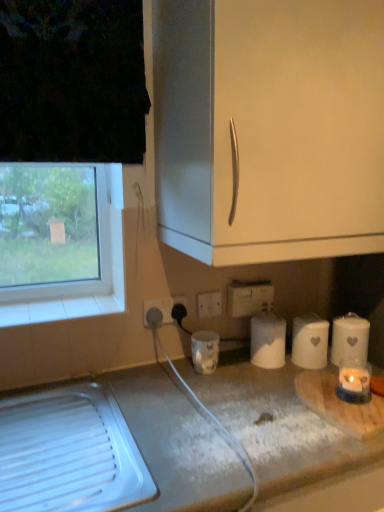
At what (x,y) coordinates should I click in order to perform the action: click on vacant region to the left of white matte paper towel at lower right, the second paper towel in the left-to-right sequence. Please return your answer as a coordinate pair (x, y). Image resolution: width=384 pixels, height=512 pixels. Looking at the image, I should click on (259, 373).